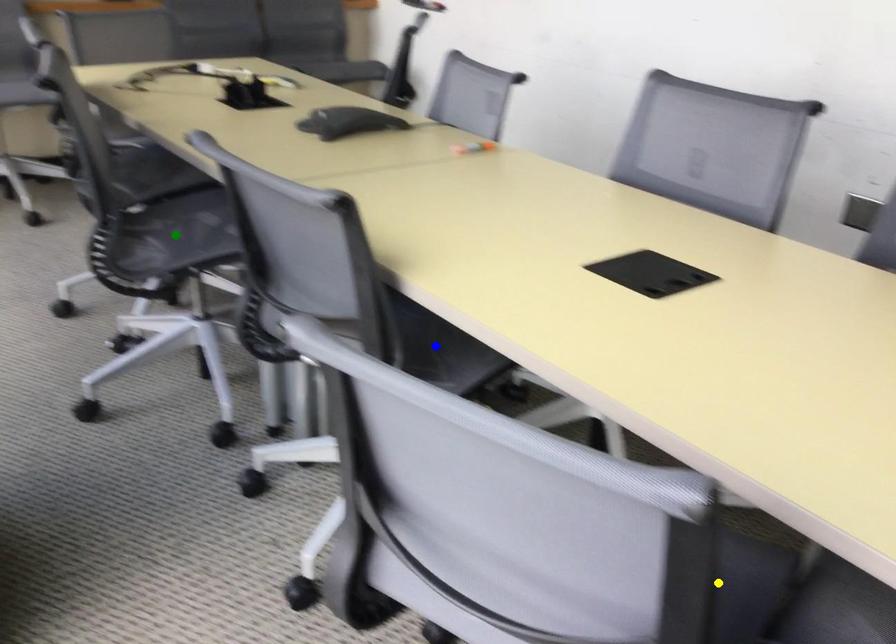
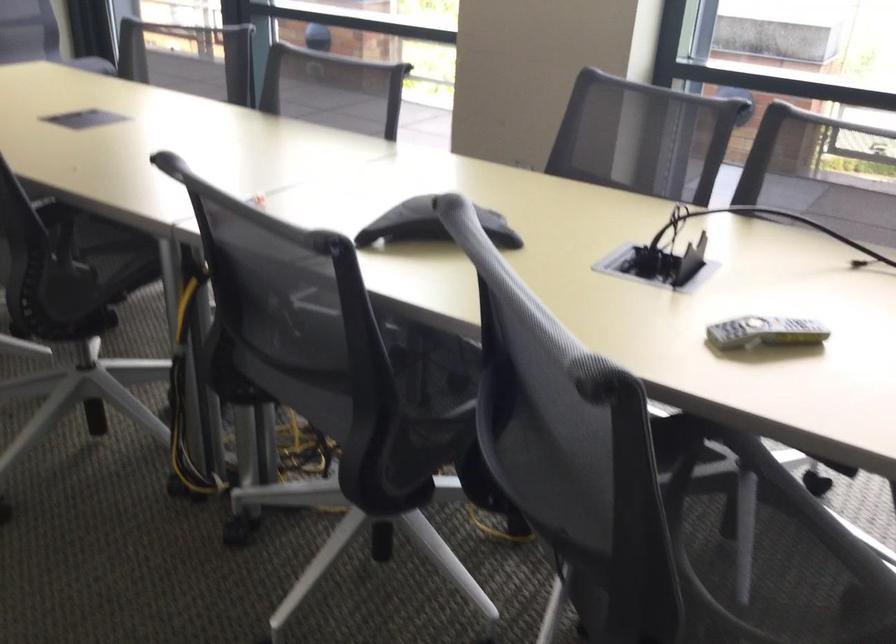
I am providing you with two images of the same scene from different viewpoints. Three points are marked in image1. Which point corresponds to a part or object that is occluded in image2?In image1, three points are marked. Which of them correspond to a part or object that is occluded in image2?Among the three points shown in image1, which one corresponds to a part or object that is no longer visible due to occlusion in image2?

Invisible in image2: green point, blue point, yellow point.